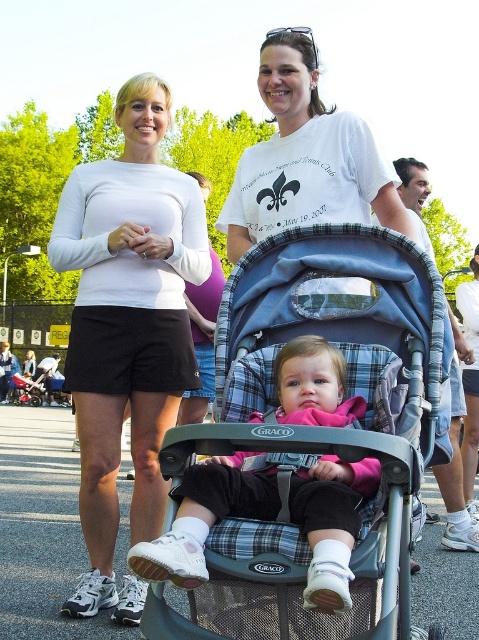
Which is behind, point (373, 237) or point (299, 108)?

Point (299, 108)

In the scene shown: Measure the distance from blue plaid fabric stroller at center to white cotton t-shirt at center.

The distance of blue plaid fabric stroller at center from white cotton t-shirt at center is 4.02 feet.

Where is `blue plaid fabric stroller at center`? The width and height of the screenshot is (479, 640). blue plaid fabric stroller at center is located at coordinates (315, 428).

Does blue plaid fabric stroller at center have a larger size compared to white matte shorts at center?

No, blue plaid fabric stroller at center is not bigger than white matte shorts at center.

Between point (399, 588) and point (76, 608), which one is positioned in front?

Positioned in front is point (399, 588).

The width and height of the screenshot is (479, 640). What do you see at coordinates (315, 428) in the screenshot?
I see `blue plaid fabric stroller at center` at bounding box center [315, 428].

This screenshot has width=479, height=640. What are the coordinates of `blue plaid fabric stroller at center` in the screenshot? It's located at (315, 428).

Where is `white matte shorts at center`? white matte shorts at center is located at coordinates (127, 328).

Does white matte shorts at center appear under white cotton t-shirt at center?

Yes, white matte shorts at center is below white cotton t-shirt at center.

Identify the location of white matte shorts at center. (127, 328).